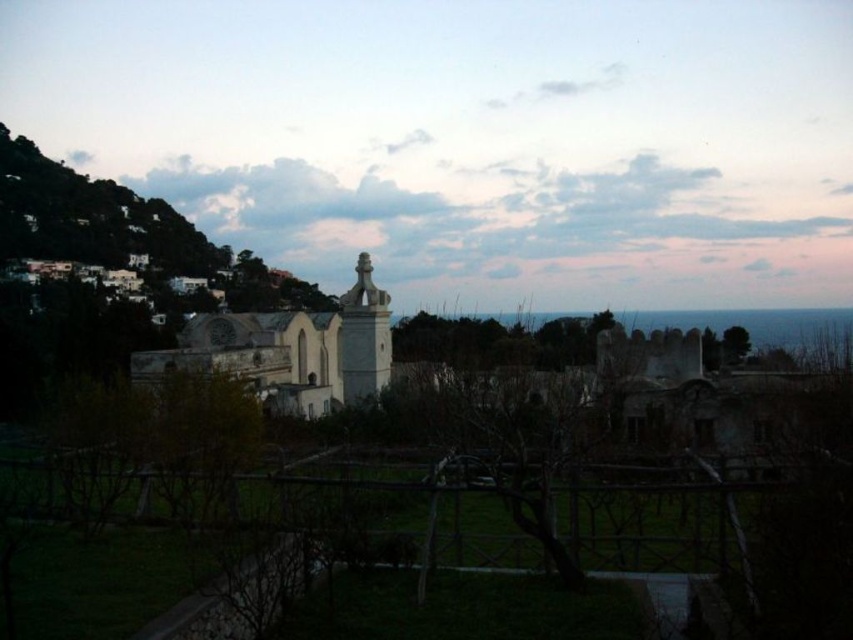
Question: Does white stone statue at center have a greater width compared to white stone church at center?

Choices:
 (A) no
 (B) yes

Answer: (B)

Question: Which of the following is the farthest from the observer?

Choices:
 (A) white stone statue at center
 (B) white stone church at center

Answer: (A)

Question: Is white stone statue at center thinner than white stone church at center?

Choices:
 (A) yes
 (B) no

Answer: (B)

Question: Is white stone statue at center further to camera compared to white stone church at center?

Choices:
 (A) no
 (B) yes

Answer: (B)